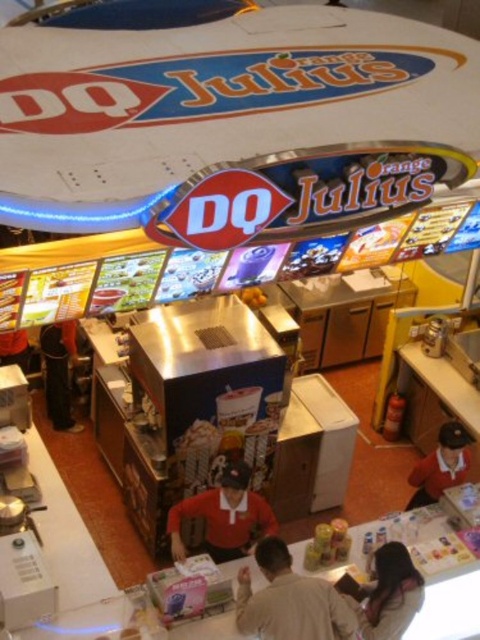
Question: Does red smooth uniform at center have a lesser width compared to white fabric shirt at lower right?

Choices:
 (A) yes
 (B) no

Answer: (B)

Question: Is light brown shirt at center behind metallic silver coffee pot at center-left?

Choices:
 (A) no
 (B) yes

Answer: (A)

Question: Which object is the closest to the red smooth uniform at center?

Choices:
 (A) metallic silver coffee pot at center-left
 (B) light brown shirt at center
 (C) matte white shirt at lower right
 (D) white fabric shirt at lower right

Answer: (B)

Question: Considering the relative positions of white fabric shirt at lower right and metallic silver coffee pot at center-left in the image provided, where is white fabric shirt at lower right located with respect to metallic silver coffee pot at center-left?

Choices:
 (A) right
 (B) left

Answer: (A)

Question: Which of the following is the farthest from the observer?

Choices:
 (A) (423, 589)
 (B) (238, 548)

Answer: (B)

Question: Estimate the real-world distances between objects in this image. Which object is closer to the matte white shirt at lower right?

Choices:
 (A) white fabric shirt at lower right
 (B) metallic silver coffee pot at center-left
 (C) red smooth uniform at center

Answer: (C)